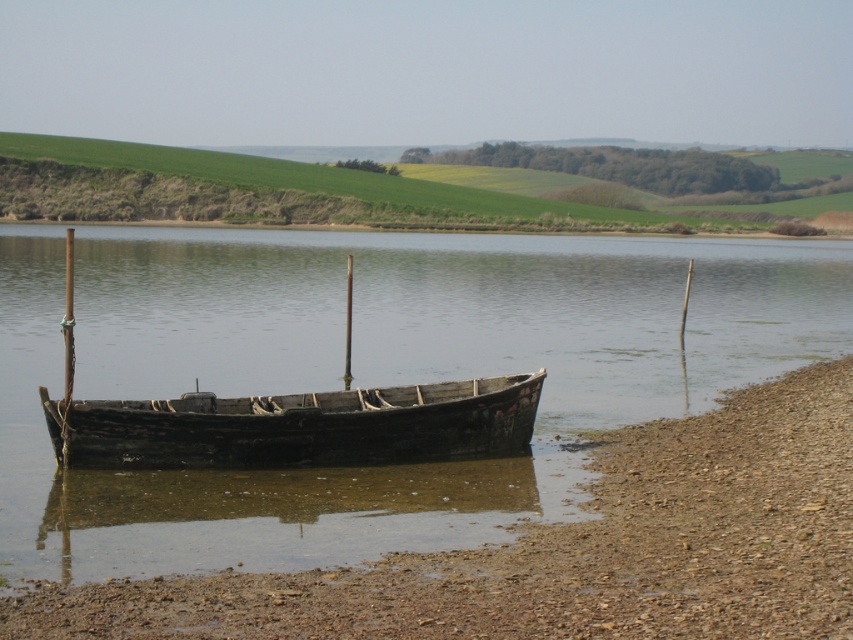
Is brown wooden boat at center closer to the viewer compared to dark brown wooden canoe at center?

Yes.

Image resolution: width=853 pixels, height=640 pixels. What do you see at coordinates (369, 372) in the screenshot? I see `brown wooden boat at center` at bounding box center [369, 372].

Does point (372, 490) lie in front of point (100, 465)?

Yes, point (372, 490) is in front of point (100, 465).

Locate an element on the screen. Image resolution: width=853 pixels, height=640 pixels. brown wooden boat at center is located at coordinates (369, 372).

Can you confirm if brown wooden boat at center is shorter than rusty wood boat at center?

No, brown wooden boat at center is not shorter than rusty wood boat at center.

Identify the location of brown wooden boat at center. (369, 372).

From the picture: Which of these two, rusty wood boat at center or dark brown wooden canoe at center, stands taller?

rusty wood boat at center is taller.

Does rusty wood boat at center appear on the right side of dark brown wooden canoe at center?

Incorrect, rusty wood boat at center is not on the right side of dark brown wooden canoe at center.

Describe the element at coordinates (291, 422) in the screenshot. The width and height of the screenshot is (853, 640). I see `rusty wood boat at center` at that location.

The width and height of the screenshot is (853, 640). I want to click on rusty wood boat at center, so click(x=291, y=422).